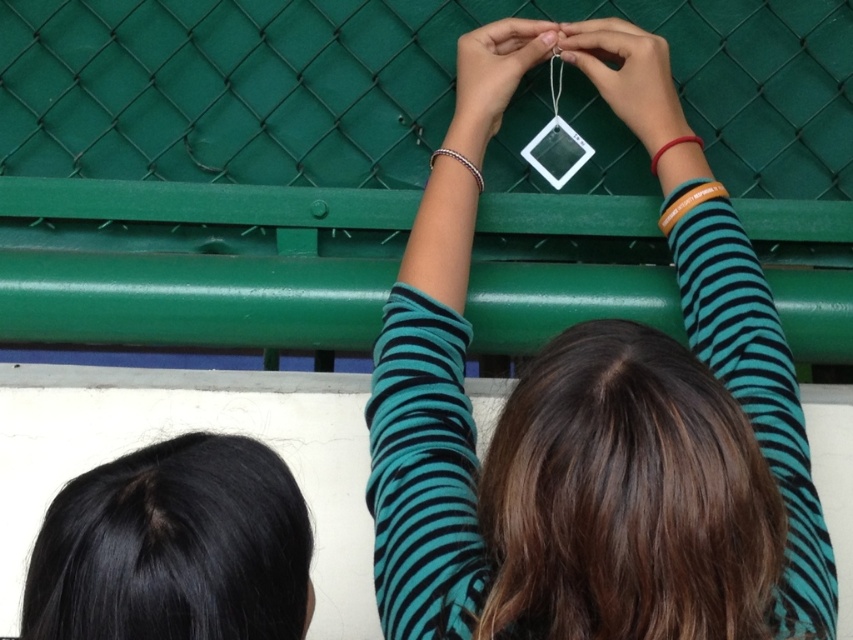
Can you confirm if clear plastic diamond at center is positioned to the left of matte white tag at upper center?

Incorrect, clear plastic diamond at center is not on the left side of matte white tag at upper center.

Measure the distance between clear plastic diamond at center and matte white tag at upper center.

The distance of clear plastic diamond at center from matte white tag at upper center is 10.74 inches.

I want to click on clear plastic diamond at center, so click(595, 451).

In order to click on clear plastic diamond at center in this screenshot , I will do pos(595,451).

Who is taller, clear plastic diamond at center or transparent plastic at upper center?

clear plastic diamond at center is taller.

Which is above, clear plastic diamond at center or transparent plastic at upper center?

transparent plastic at upper center

You are a GUI agent. You are given a task and a screenshot of the screen. Output one action in this format:
    pyautogui.click(x=<x>, y=<y>)
    Task: Click on the clear plastic diamond at center
    The width and height of the screenshot is (853, 640).
    Given the screenshot: What is the action you would take?
    pyautogui.click(x=595, y=451)

Which is more to the left, black smooth hair at upper center or transparent plastic at upper center?

black smooth hair at upper center

Is black smooth hair at upper center further to camera compared to transparent plastic at upper center?

No, black smooth hair at upper center is in front of transparent plastic at upper center.

Who is more distant from viewer, (251, 532) or (599, 52)?

The point (599, 52) is more distant.

The image size is (853, 640). What are the coordinates of `black smooth hair at upper center` in the screenshot? It's located at (173, 547).